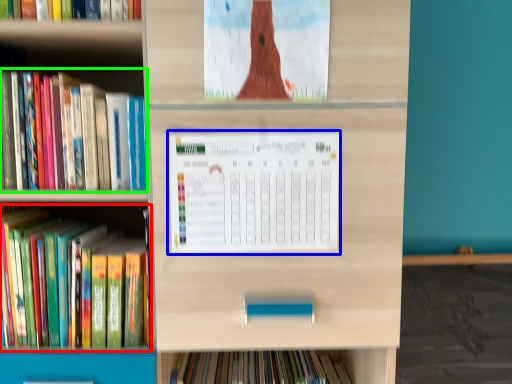
Question: Considering the real-world distances, which object is closest to book (highlighted by a red box)? paperback book (highlighted by a blue box) or book (highlighted by a green box).

Choices:
 (A) paperback book
 (B) book

Answer: (B)